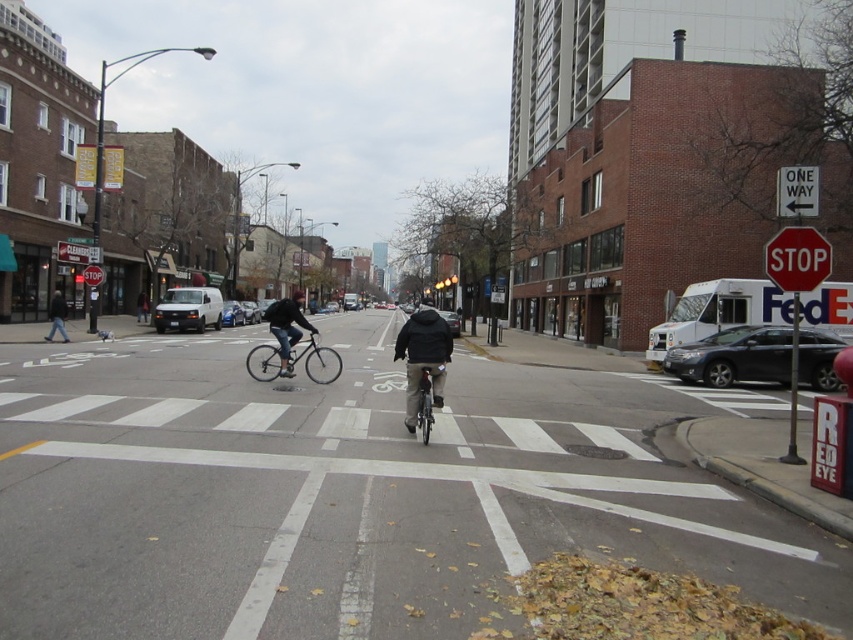
Between dark gray jacket at center and red metal stop sign at upper right, which one appears on the right side from the viewer's perspective?

From the viewer's perspective, red metal stop sign at upper right appears more on the right side.

Based on the photo, does dark gray jacket at center appear over red metal stop sign at upper right?

Incorrect, dark gray jacket at center is not positioned above red metal stop sign at upper right.

Find the location of a particular element. This screenshot has height=640, width=853. dark gray jacket at center is located at coordinates (422, 356).

At what (x,y) coordinates should I click in order to perform the action: click on dark gray jacket at center. Please return your answer as a coordinate pair (x, y). The image size is (853, 640). Looking at the image, I should click on (422, 356).

Can you confirm if dark blue jeans at lower left is taller than black matte car at center?

Correct, dark blue jeans at lower left is much taller as black matte car at center.

Where is `dark blue jeans at lower left`? The height and width of the screenshot is (640, 853). dark blue jeans at lower left is located at coordinates (57, 316).

Looking at this image, is dark blue jeans at lower left closer to the viewer compared to silver metallic sedan at center?

Yes, it is in front of silver metallic sedan at center.

What do you see at coordinates (57, 316) in the screenshot?
I see `dark blue jeans at lower left` at bounding box center [57, 316].

What do you see at coordinates (57, 316) in the screenshot? I see `dark blue jeans at lower left` at bounding box center [57, 316].

You are a GUI agent. You are given a task and a screenshot of the screen. Output one action in this format:
    pyautogui.click(x=<x>, y=<y>)
    Task: Click on the dark blue jeans at lower left
    The image size is (853, 640).
    Given the screenshot: What is the action you would take?
    pyautogui.click(x=57, y=316)